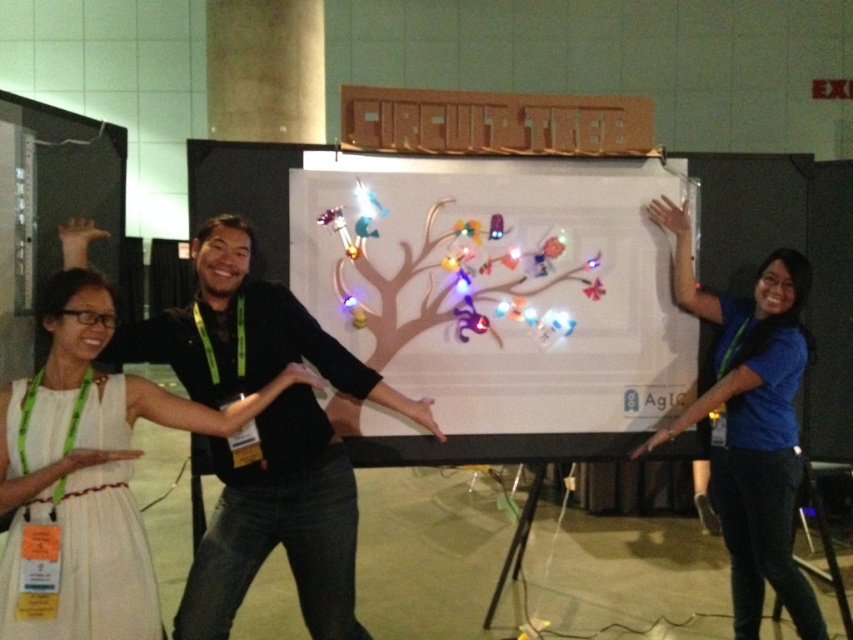
You are standing in front of the whiteboard and want to place a new sticky note on the white paper at center. What are the coordinates where you should place it?

The white paper at center is located at coordinates point (495, 301), so you should place the sticky note there.